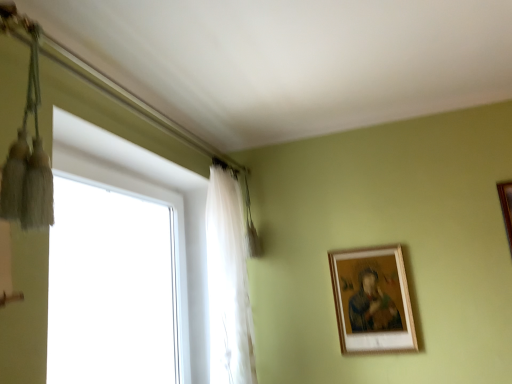
Question: Considering the positions of translucent white curtain at upper left and white glass window at left in the image, is translucent white curtain at upper left taller or shorter than white glass window at left?

Choices:
 (A) tall
 (B) short

Answer: (A)

Question: Would you say translucent white curtain at upper left is to the left or to the right of white glass window at left in the picture?

Choices:
 (A) right
 (B) left

Answer: (A)

Question: Estimate the real-world distances between objects in this image. Which object is farther from the wooden picture frame at upper right, which appears as the first picture frame when ordered from the bottom?

Choices:
 (A) translucent white curtain at upper left
 (B) white glass window at left
 (C) brown wooden picture frame at upper right, the second picture frame positioned from the left

Answer: (B)

Question: Considering the real-world distances, which object is closest to the translucent white curtain at upper left?

Choices:
 (A) wooden picture frame at upper right, the first picture frame when ordered from left to right
 (B) brown wooden picture frame at upper right, the second picture frame positioned from the left
 (C) white glass window at left

Answer: (C)